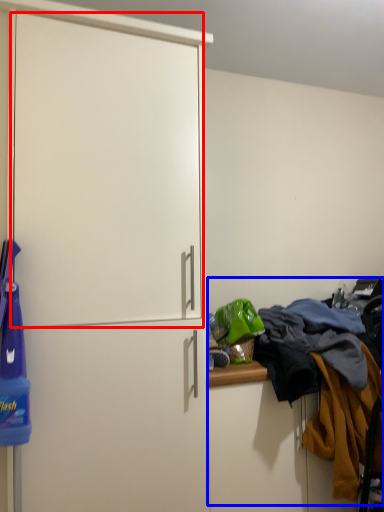
Question: Which object appears closest to the camera in this image, screen door (highlighted by a red box) or laundry (highlighted by a blue box)?

Choices:
 (A) screen door
 (B) laundry

Answer: (A)